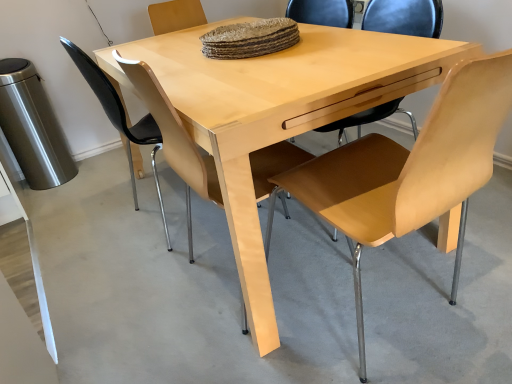
You are a GUI agent. You are given a task and a screenshot of the screen. Output one action in this format:
    pyautogui.click(x=<x>, y=<y>)
    Task: Click on the empty space that is ontop of light wood table at center (from a real-world perspective)
    This screenshot has width=512, height=384.
    Given the screenshot: What is the action you would take?
    pyautogui.click(x=226, y=61)